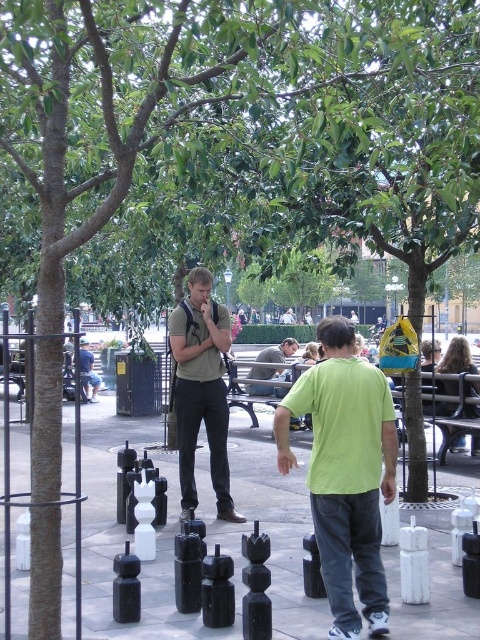
Question: Which of the following is the closest to the observer?

Choices:
 (A) green t-shirt at center
 (B) light blue jeans at center
 (C) light green t-shirt at center
 (D) matte green t-shirt at center

Answer: (C)

Question: Which of the following is the closest to the observer?

Choices:
 (A) black plastic chess pieces at center
 (B) green t-shirt at center
 (C) blonde hair at center
 (D) light blue jeans at center

Answer: (A)

Question: Which point is closer to the camera?

Choices:
 (A) (80, 355)
 (B) (220, 513)
 (C) (312, 392)
 (D) (211, 486)

Answer: (C)

Question: Does black plastic chess pieces at center appear on the left side of blonde hair at center?

Choices:
 (A) no
 (B) yes

Answer: (B)

Question: Can you confirm if black plastic chess pieces at center is bigger than light blue jeans at center?

Choices:
 (A) no
 (B) yes

Answer: (A)

Question: In this image, where is green t-shirt at center located relative to light blue jeans at center?

Choices:
 (A) above
 (B) below

Answer: (A)